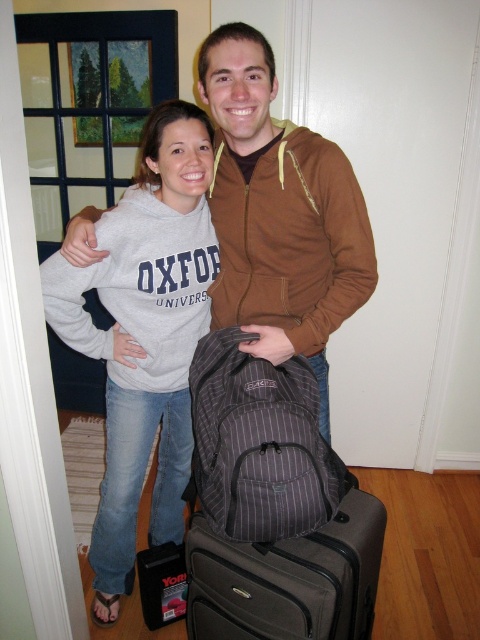
Question: Can you confirm if brown zip-up hoodie at center is positioned below brown fleece sweatshirt at center?

Choices:
 (A) yes
 (B) no

Answer: (A)

Question: Does gray cotton sweatshirt at center have a greater width compared to brown fleece sweatshirt at center?

Choices:
 (A) yes
 (B) no

Answer: (B)

Question: Is gray cotton sweatshirt at center further to the viewer compared to brown zip-up hoodie at center?

Choices:
 (A) yes
 (B) no

Answer: (A)

Question: Considering the real-world distances, which object is closest to the brown fleece sweatshirt at center?

Choices:
 (A) gray striped backpack at lower center
 (B) gray cotton sweatshirt at center
 (C) brown zip-up hoodie at center

Answer: (C)

Question: Which point is farther from the camera taking this photo?

Choices:
 (A) (271, 157)
 (B) (344, 252)
 (C) (207, 570)
 (D) (168, 404)

Answer: (D)

Question: Estimate the real-world distances between objects in this image. Which object is farther from the brown zip-up hoodie at center?

Choices:
 (A) brown fleece sweatshirt at center
 (B) gray cotton sweatshirt at center

Answer: (B)